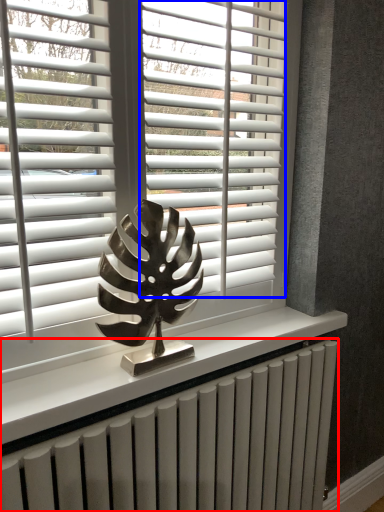
Question: Which object is closer to the camera taking this photo, radiator (highlighted by a red box) or blind (highlighted by a blue box)?

Choices:
 (A) radiator
 (B) blind

Answer: (A)